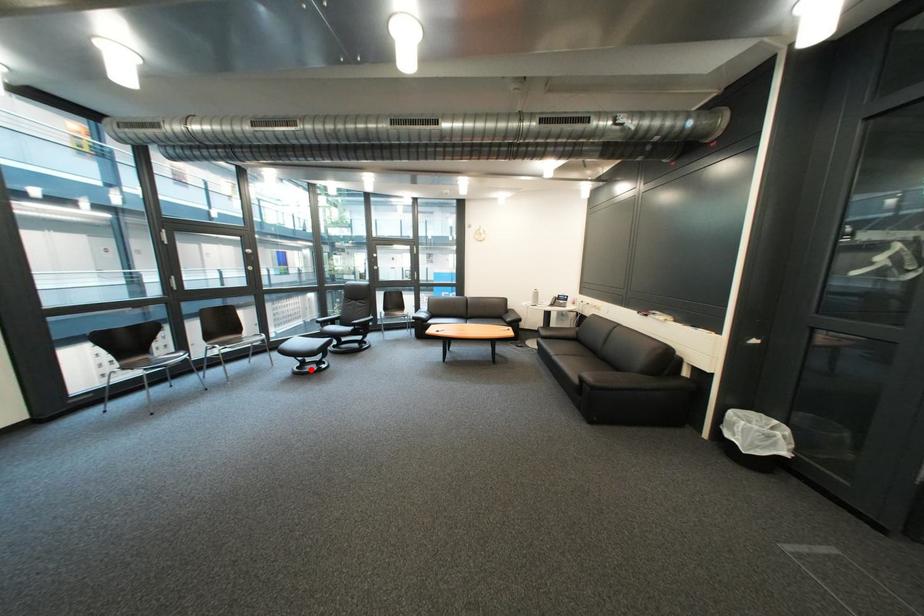
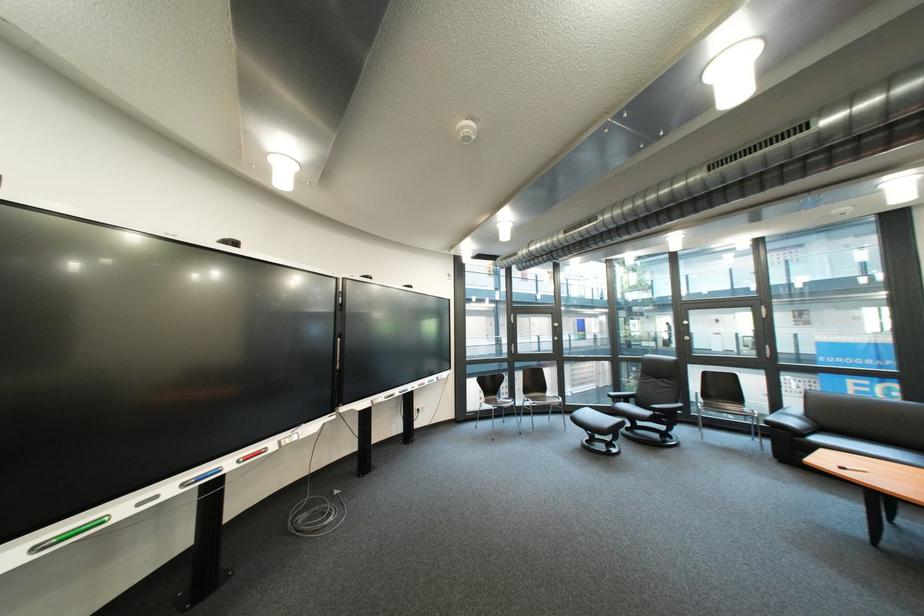
The point at the highlighted location is marked in the first image. Where is the corresponding point in the second image?

(601, 443)